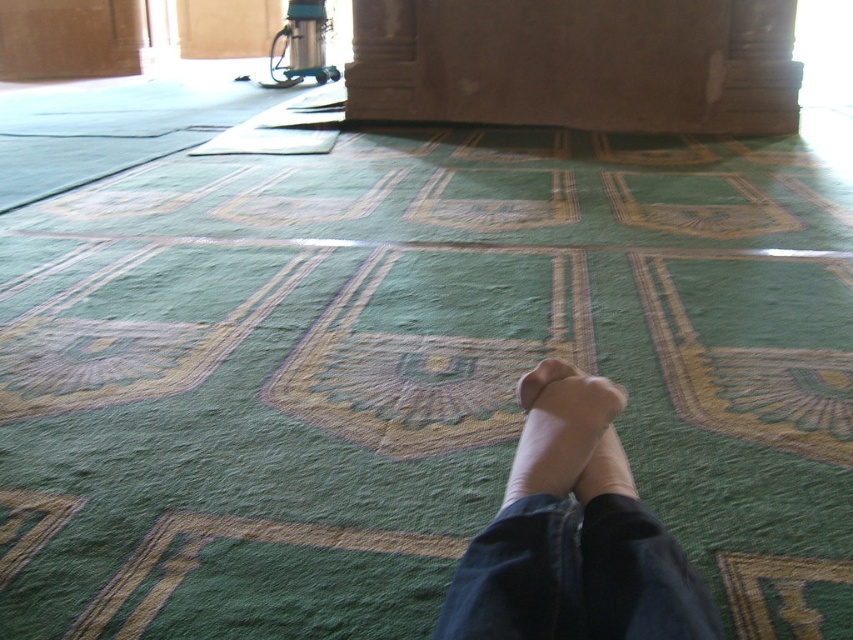
How far apart are smooth beige socks at center and suede-like beige foot at lower center?

smooth beige socks at center is 1.73 inches away from suede-like beige foot at lower center.

Who is taller, smooth beige socks at center or suede-like beige foot at lower center?

smooth beige socks at center is taller.

This screenshot has height=640, width=853. Find the location of `smooth beige socks at center`. smooth beige socks at center is located at coordinates (573, 534).

Identify the location of smooth beige socks at center. The height and width of the screenshot is (640, 853). (573, 534).